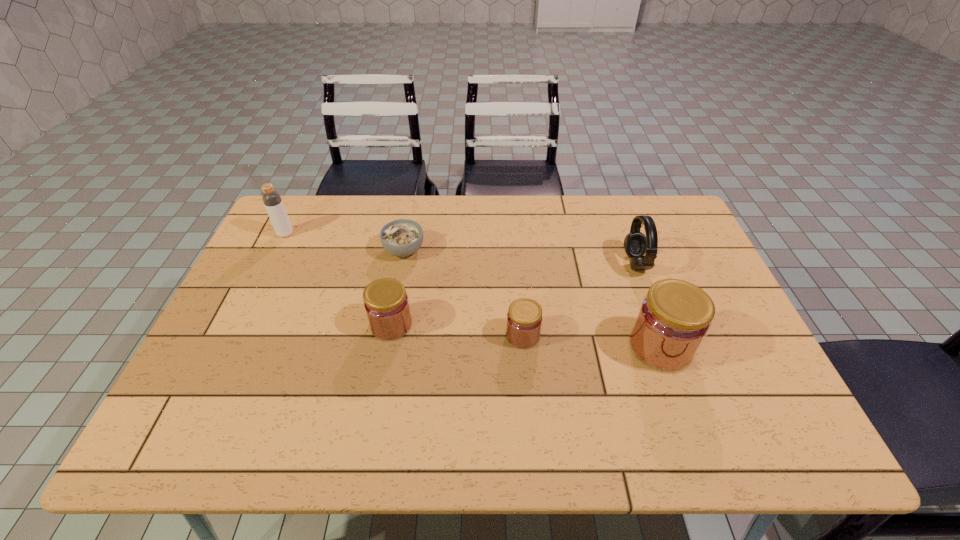
Where is `free space located 0.100m on the left of the rightmost jam`? This screenshot has width=960, height=540. free space located 0.100m on the left of the rightmost jam is located at coordinates tap(588, 347).

Locate an element on the screen. The width and height of the screenshot is (960, 540). free region located 0.290m on the earcups of the headset is located at coordinates (529, 263).

Image resolution: width=960 pixels, height=540 pixels. I want to click on free space located 0.280m on the earcups of the headset, so click(x=532, y=263).

Locate an element on the screen. The width and height of the screenshot is (960, 540). vacant space situated on the earcups of the headset is located at coordinates (582, 263).

The width and height of the screenshot is (960, 540). I want to click on free region located 0.300m on the front of the shortest object, so click(x=387, y=346).

Where is `free space located 0.370m on the front of the bottle`? This screenshot has height=540, width=960. free space located 0.370m on the front of the bottle is located at coordinates (238, 331).

Where is `soup bowl that is positioned at the far edge`? The image size is (960, 540). soup bowl that is positioned at the far edge is located at coordinates (403, 237).

The height and width of the screenshot is (540, 960). I want to click on bottle located at the far edge, so (271, 198).

The width and height of the screenshot is (960, 540). In order to click on object positioned at the left edge in this screenshot , I will do `click(271, 198)`.

Find the location of a particular element. This screenshot has width=960, height=540. object that is at the right edge is located at coordinates (674, 318).